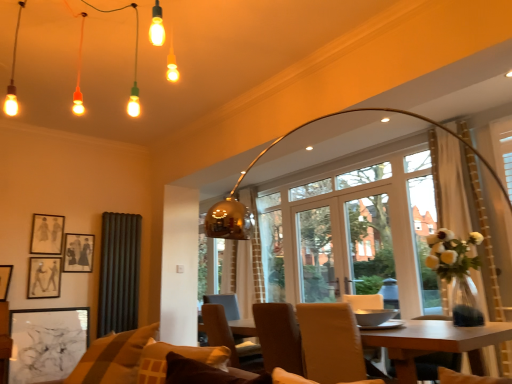
Question: Is brown leather chair at center, the second chair from the front, spatially inside matte black picture frame at upper left, the 4th picture frame ordered from the bottom, or outside of it?

Choices:
 (A) outside
 (B) inside

Answer: (A)

Question: Visually, is brown leather chair at center, positioned as the second chair in right-to-left order, positioned to the left or to the right of matte black picture frame at upper left, the 4th picture frame ordered from the bottom?

Choices:
 (A) right
 (B) left

Answer: (A)

Question: Which object is positioned farthest from the brown leather chair at center, which is counted as the first chair, starting from the left?

Choices:
 (A) black matte picture frame at upper left, which appears as the second picture frame when ordered from the bottom
 (B) transparent glass screen door at center
 (C) dark gray fabric curtain at left, the second curtain in the back-to-front sequence
 (D) wooden table at center
 (E) brown fabric couch at lower center

Answer: (A)

Question: Considering the real-world distances, which object is farthest from the matte black picture frame at upper left, which is counted as the third picture frame, starting from the bottom?

Choices:
 (A) gold metallic curtain at center, the 2th curtain from the left
 (B) brown fabric couch at lower center
 (C) wooden table at center
 (D) brown leather chair at center, the first chair in the back-to-front sequence
 (E) metallic gold chandelier at upper center

Answer: (C)